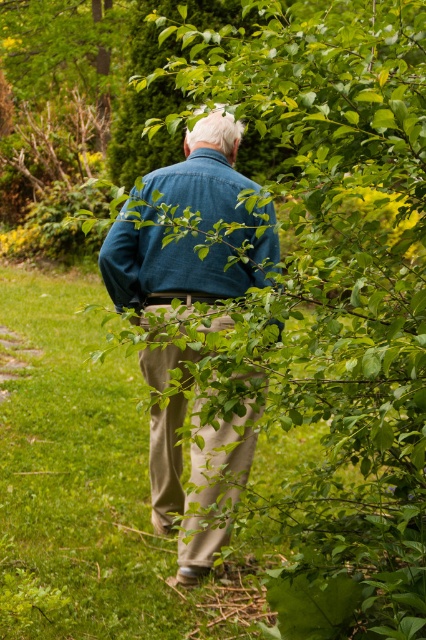
You are a hiker who wants to sit down on the green grass at center. However, you have a denim jacket at center that you need to place nearby. Based on the scene description, which object is taller, allowing you to place the jacket on top of it?

The denim jacket at center is taller than the green grass at center, so you can place the jacket on top of the denim jacket at center.

You are a photographer positioned to capture the scene described. You notice the green grass at center and the denim jacket at center. Based on their positions, which object is closer to the left edge of your frame?

The green grass at center is to the left of the denim jacket at center, so the green grass at center is closer to the left edge of the frame.